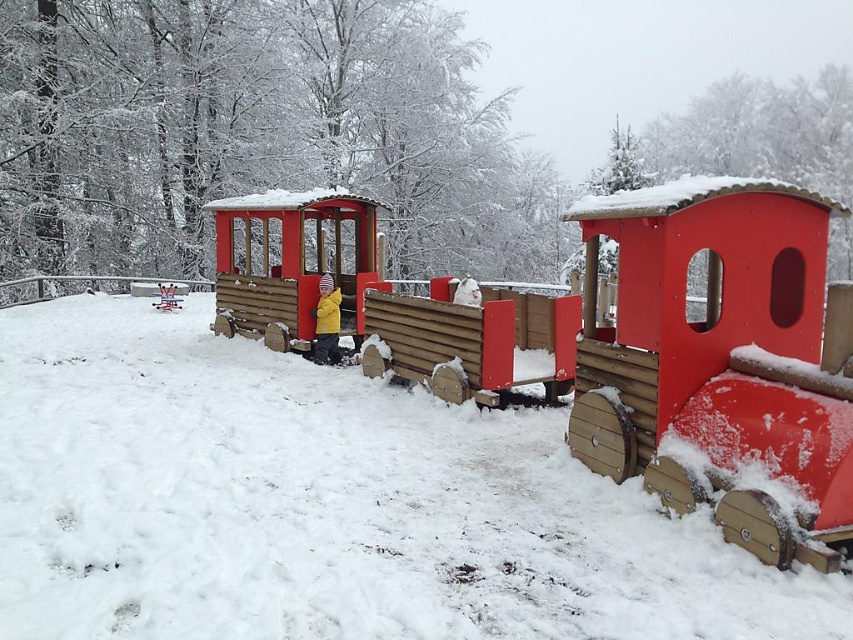
Question: Which point is farther to the camera?

Choices:
 (A) (325, 324)
 (B) (322, 273)
 (C) (422, 352)

Answer: (B)

Question: Is wooden train car at center above yellow fleece jacket at center?

Choices:
 (A) no
 (B) yes

Answer: (B)

Question: Among these points, which one is nearest to the camera?

Choices:
 (A) (303, 230)
 (B) (337, 339)

Answer: (B)

Question: Which point is closer to the camera taking this photo?

Choices:
 (A) (271, 211)
 (B) (694, 208)
 (C) (323, 321)

Answer: (B)

Question: Is wooden train car at center positioned behind yellow fleece jacket at center?

Choices:
 (A) no
 (B) yes

Answer: (A)

Question: Can you confirm if wooden train car at center is bigger than yellow fleece jacket at center?

Choices:
 (A) yes
 (B) no

Answer: (A)